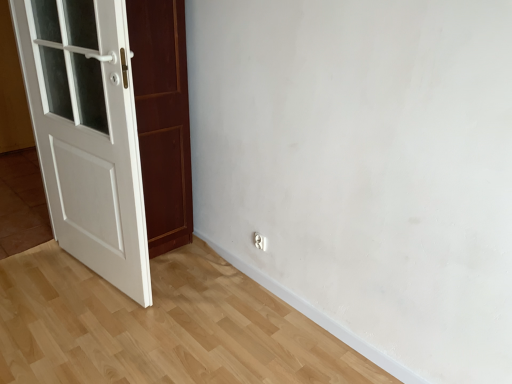
At what (x,y) coordinates should I click in order to perform the action: click on white glossy electric outlet at lower center. Please return your answer as a coordinate pair (x, y). The width and height of the screenshot is (512, 384). Looking at the image, I should click on (260, 241).

The height and width of the screenshot is (384, 512). What do you see at coordinates (260, 241) in the screenshot?
I see `white glossy electric outlet at lower center` at bounding box center [260, 241].

Where is `white wooden door at left`? The image size is (512, 384). white wooden door at left is located at coordinates (88, 133).

The image size is (512, 384). What do you see at coordinates (88, 133) in the screenshot? I see `white wooden door at left` at bounding box center [88, 133].

Measure the distance between point (36, 112) and camera.

7.18 feet.

At what (x,y) coordinates should I click in order to perform the action: click on white glossy electric outlet at lower center. Please return your answer as a coordinate pair (x, y). Looking at the image, I should click on (260, 241).

Considering the positions of objects white glossy electric outlet at lower center and white wooden door at left in the image provided, who is more to the right, white glossy electric outlet at lower center or white wooden door at left?

From the viewer's perspective, white glossy electric outlet at lower center appears more on the right side.

Does white glossy electric outlet at lower center come behind white wooden door at left?

Yes.

Is point (264, 250) less distant than point (60, 139)?

No, it is not.

From the image's perspective, which object appears higher, white glossy electric outlet at lower center or white wooden door at left?

white wooden door at left is shown above in the image.

From a real-world perspective, who is located higher, white glossy electric outlet at lower center or white wooden door at left?

white wooden door at left.

Between white glossy electric outlet at lower center and white wooden door at left, which one has larger width?

white wooden door at left is wider.

Consider the image. Who is taller, white glossy electric outlet at lower center or white wooden door at left?

white wooden door at left.

Between white glossy electric outlet at lower center and white wooden door at left, which one has larger size?

white wooden door at left is bigger.

Is white glossy electric outlet at lower center not inside white wooden door at left?

That's correct, white glossy electric outlet at lower center is outside of white wooden door at left.

Is white glossy electric outlet at lower center next to white wooden door at left and touching it?

No, white glossy electric outlet at lower center is not making contact with white wooden door at left.

Is white glossy electric outlet at lower center facing towards white wooden door at left?

No.

Find the location of a particular element. The image size is (512, 384). electric outlet below the white wooden door at left (from the image's perspective) is located at coordinates (260, 241).

Which is more to the right, white wooden door at left or white glossy electric outlet at lower center?

white glossy electric outlet at lower center is more to the right.

In the image, is white wooden door at left positioned in front of or behind white glossy electric outlet at lower center?

In the image, white wooden door at left appears in front of white glossy electric outlet at lower center.

Which is behind, point (127, 31) or point (262, 238)?

Point (262, 238)

From the image's perspective, which is below, white wooden door at left or white glossy electric outlet at lower center?

white glossy electric outlet at lower center, from the image's perspective.

From a real-world perspective, is white wooden door at left on white glossy electric outlet at lower center?

Yes, from a real-world perspective, white wooden door at left is on top of white glossy electric outlet at lower center.

Does white wooden door at left have a greater width compared to white glossy electric outlet at lower center?

Indeed, white wooden door at left has a greater width compared to white glossy electric outlet at lower center.

Considering the relative sizes of white wooden door at left and white glossy electric outlet at lower center in the image provided, is white wooden door at left shorter than white glossy electric outlet at lower center?

In fact, white wooden door at left may be taller than white glossy electric outlet at lower center.

Can you confirm if white wooden door at left is bigger than white glossy electric outlet at lower center?

Yes.

Is white wooden door at left outside of white glossy electric outlet at lower center?

Yes, white wooden door at left is located beyond the bounds of white glossy electric outlet at lower center.

Is white wooden door at left not close to white glossy electric outlet at lower center?

Yes.

From the picture: Could you tell me if white wooden door at left is facing white glossy electric outlet at lower center?

Yes, white wooden door at left faces towards white glossy electric outlet at lower center.

You are a GUI agent. You are given a task and a screenshot of the screen. Output one action in this format:
    pyautogui.click(x=<x>, y=<y>)
    Task: Click on the electric outlet that is under the white wooden door at left (from a real-world perspective)
    
    Given the screenshot: What is the action you would take?
    pyautogui.click(x=260, y=241)

Find the location of a particular element. The height and width of the screenshot is (384, 512). electric outlet below the white wooden door at left (from the image's perspective) is located at coordinates (260, 241).

At what (x,y) coordinates should I click in order to perform the action: click on door above the white glossy electric outlet at lower center (from a real-world perspective). Please return your answer as a coordinate pair (x, y). Looking at the image, I should click on (88, 133).